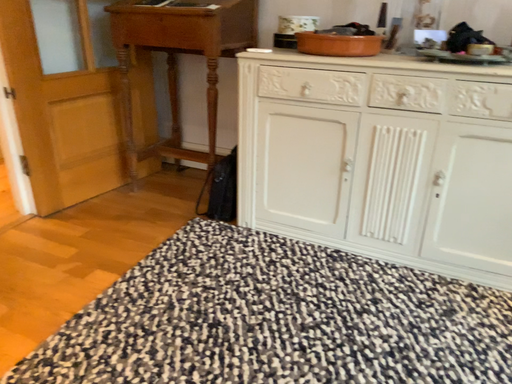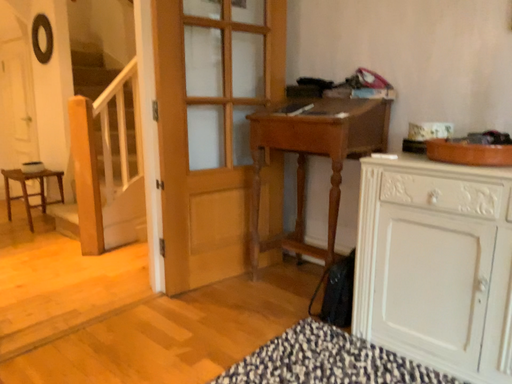
Question: How did the camera likely rotate when shooting the video?

Choices:
 (A) rotated left
 (B) rotated right

Answer: (A)